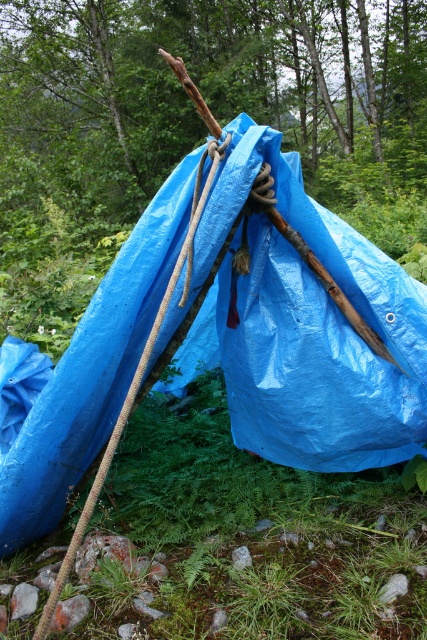
Question: Which of these objects is positioned farthest from the blue tarpaulin at center?

Choices:
 (A) blue tarpaulin tent at center
 (B) roperoughrope at left

Answer: (A)

Question: Is blue tarpaulin at center to the right of blue tarpaulin tent at center from the viewer's perspective?

Choices:
 (A) yes
 (B) no

Answer: (B)

Question: Among these objects, which one is farthest from the camera?

Choices:
 (A) roperoughrope at left
 (B) blue tarpaulin tent at center

Answer: (B)

Question: Estimate the real-world distances between objects in this image. Which object is farther from the roperoughrope at left?

Choices:
 (A) blue tarpaulin tent at center
 (B) blue tarpaulin at center

Answer: (A)

Question: Does blue tarpaulin at center appear on the left side of blue tarpaulin tent at center?

Choices:
 (A) no
 (B) yes

Answer: (B)

Question: In this image, where is blue tarpaulin tent at center located relative to roperoughrope at left?

Choices:
 (A) left
 (B) right

Answer: (B)